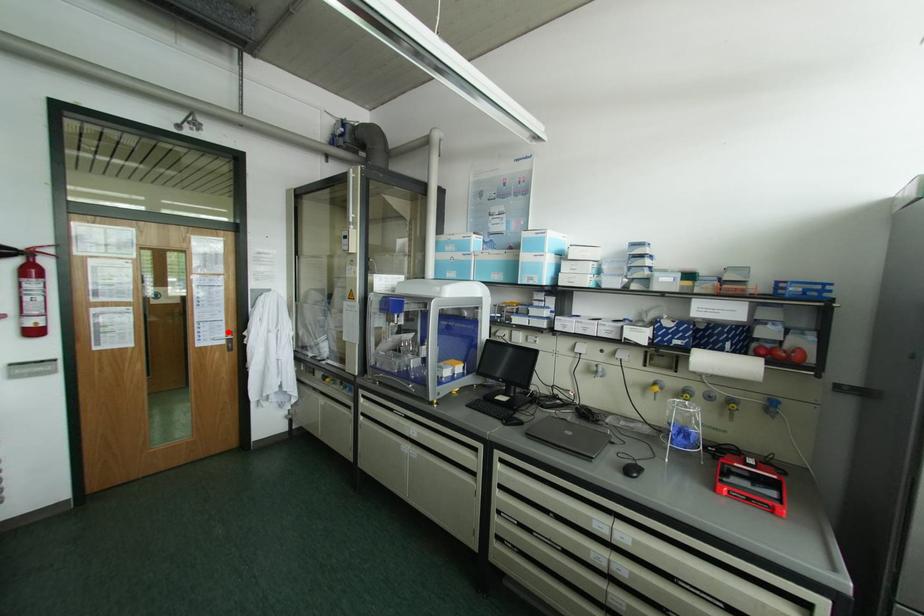
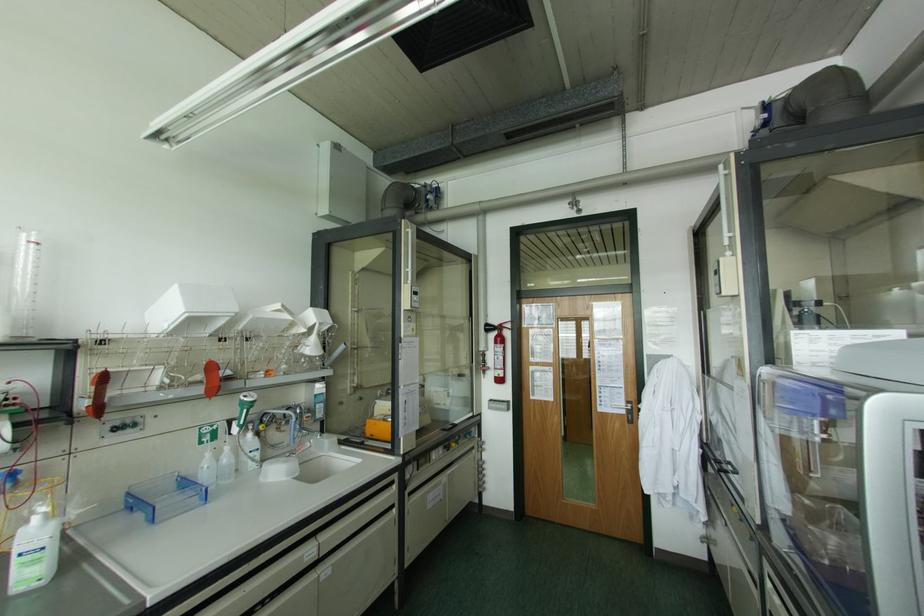
In the second image, find the point that corresponds to the highlighted location in the first image.

(626, 400)